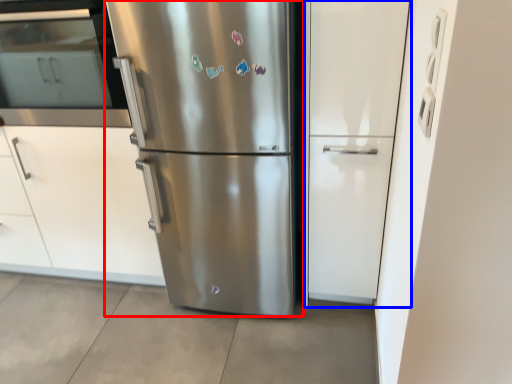
Question: Which object appears closest to the camera in this image, refrigerator (highlighted by a red box) or glass door (highlighted by a blue box)?

Choices:
 (A) refrigerator
 (B) glass door

Answer: (A)